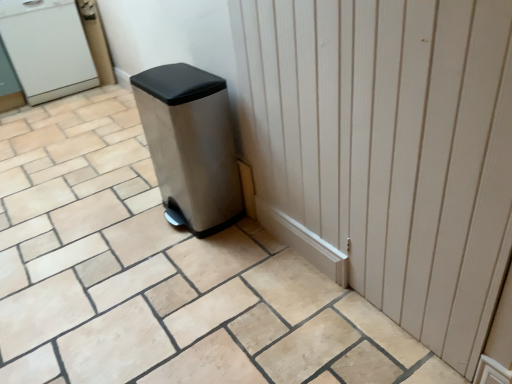
The image size is (512, 384). What are the coordinates of `free space in front of white wood door at center` in the screenshot? It's located at (341, 335).